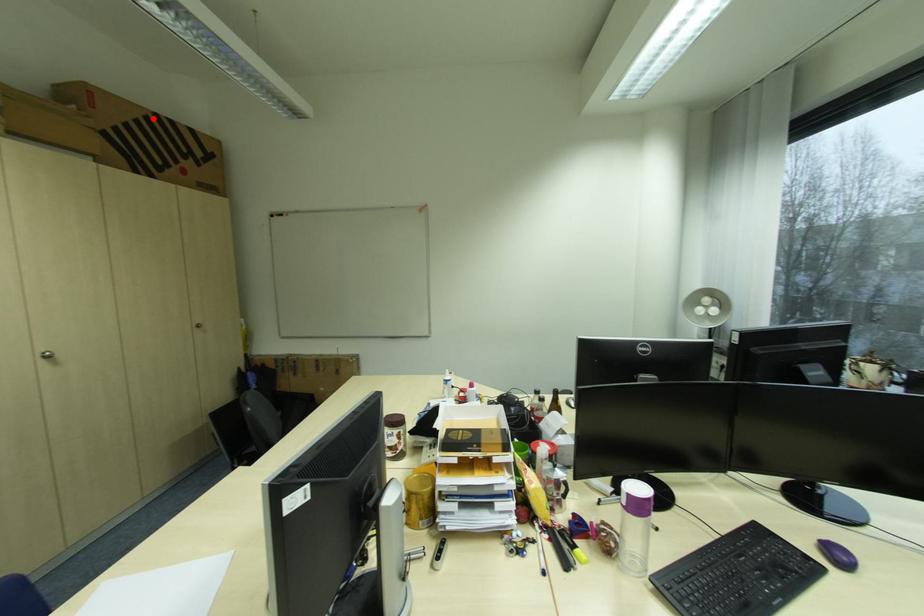
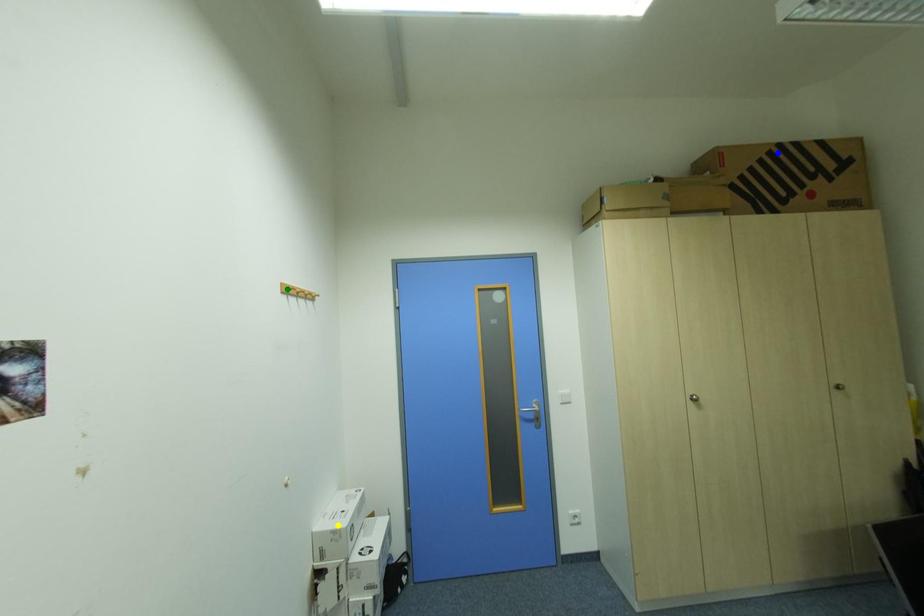
Question: I am providing you with two images of the same scene from different viewpoints. A red point is marked on the first image. You are given multiple points on the second image. In image 2, which mark is for the same physical point as the one in image 1?

Choices:
 (A) green point
 (B) yellow point
 (C) blue point

Answer: (C)